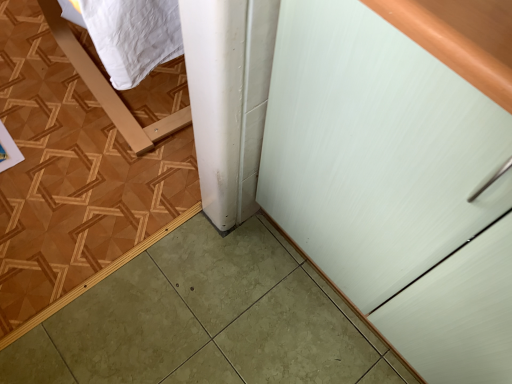
In order to face green glossy tile at lower left, should I rotate leftwards or rightwards?

Rotate your view left by about 26.164°.

Measure the distance between green glossy tile at lower left and camera.

A distance of 1.02 meters exists between green glossy tile at lower left and camera.

Describe the element at coordinates (80, 172) in the screenshot. I see `green glossy tile at lower left` at that location.

The width and height of the screenshot is (512, 384). In order to click on green glossy tile at lower left in this screenshot , I will do `click(80, 172)`.

The width and height of the screenshot is (512, 384). What do you see at coordinates (396, 179) in the screenshot?
I see `white matte cabinet at right` at bounding box center [396, 179].

Where is `white matte cabinet at right`? white matte cabinet at right is located at coordinates (396, 179).

Identify the location of green glossy tile at lower left. This screenshot has width=512, height=384. (80, 172).

Can you confirm if green glossy tile at lower left is positioned to the right of white matte cabinet at right?

No, green glossy tile at lower left is not to the right of white matte cabinet at right.

Does green glossy tile at lower left lie in front of white matte cabinet at right?

No, green glossy tile at lower left is further to the viewer.

Considering the points (60, 293) and (425, 363), which point is in front, point (60, 293) or point (425, 363)?

The point (425, 363) is closer to the camera.

From the image's perspective, would you say green glossy tile at lower left is shown under white matte cabinet at right?

Actually, green glossy tile at lower left appears above white matte cabinet at right in the image.

From a real-world perspective, is green glossy tile at lower left on white matte cabinet at right?

No, from a real-world perspective, green glossy tile at lower left is not on top of white matte cabinet at right.

Considering the sizes of objects green glossy tile at lower left and white matte cabinet at right in the image provided, who is thinner, green glossy tile at lower left or white matte cabinet at right?

Thinner between the two is white matte cabinet at right.

Considering the relative sizes of green glossy tile at lower left and white matte cabinet at right in the image provided, is green glossy tile at lower left shorter than white matte cabinet at right?

Indeed, green glossy tile at lower left has a lesser height compared to white matte cabinet at right.

Considering the sizes of green glossy tile at lower left and white matte cabinet at right in the image, is green glossy tile at lower left bigger or smaller than white matte cabinet at right?

Considering their sizes, green glossy tile at lower left takes up less space than white matte cabinet at right.

Can white matte cabinet at right be found inside green glossy tile at lower left?

Actually, white matte cabinet at right is outside green glossy tile at lower left.

Are green glossy tile at lower left and white matte cabinet at right located far from each other?

green glossy tile at lower left is actually quite close to white matte cabinet at right.

Could you tell me if green glossy tile at lower left is turned towards white matte cabinet at right?

No, green glossy tile at lower left is not oriented towards white matte cabinet at right.

How far apart are green glossy tile at lower left and white matte cabinet at right?

green glossy tile at lower left and white matte cabinet at right are 27.28 inches apart.

The height and width of the screenshot is (384, 512). In the image, there is a white matte cabinet at right. In order to click on ceramic tile below it (from a real-world perspective) in this screenshot , I will do `click(80, 172)`.

Is white matte cabinet at right at the right side of green glossy tile at lower left?

Correct, you'll find white matte cabinet at right to the right of green glossy tile at lower left.

Consider the image. Does white matte cabinet at right come behind green glossy tile at lower left?

No.

Is point (439, 113) positioned in front of point (193, 187)?

That is True.

From the image's perspective, which is above, white matte cabinet at right or green glossy tile at lower left?

green glossy tile at lower left, from the image's perspective.

Based on the photo, from a real-world perspective, is white matte cabinet at right beneath green glossy tile at lower left?

No, from a real-world perspective, white matte cabinet at right is not below green glossy tile at lower left.

Consider the image. Can you confirm if white matte cabinet at right is wider than green glossy tile at lower left?

Incorrect, the width of white matte cabinet at right does not surpass that of green glossy tile at lower left.

Who is taller, white matte cabinet at right or green glossy tile at lower left?

Standing taller between the two is white matte cabinet at right.

Who is smaller, white matte cabinet at right or green glossy tile at lower left?

Smaller between the two is green glossy tile at lower left.

Would you say green glossy tile at lower left is part of white matte cabinet at right's contents?

No.

Does white matte cabinet at right touch green glossy tile at lower left?

They are not placed beside each other.

Is white matte cabinet at right oriented away from green glossy tile at lower left?

No, white matte cabinet at right's orientation is not away from green glossy tile at lower left.

How many degrees apart are the facing directions of white matte cabinet at right and green glossy tile at lower left?

89.2 degrees.

Where is `ceramic tile located above the white matte cabinet at right (from the image's perspective)`? The image size is (512, 384). ceramic tile located above the white matte cabinet at right (from the image's perspective) is located at coordinates (80, 172).

This screenshot has width=512, height=384. Identify the location of ceramic tile behind the white matte cabinet at right. (80, 172).

What are the coordinates of `ceramic tile above the white matte cabinet at right (from the image's perspective)` in the screenshot? It's located at (80, 172).